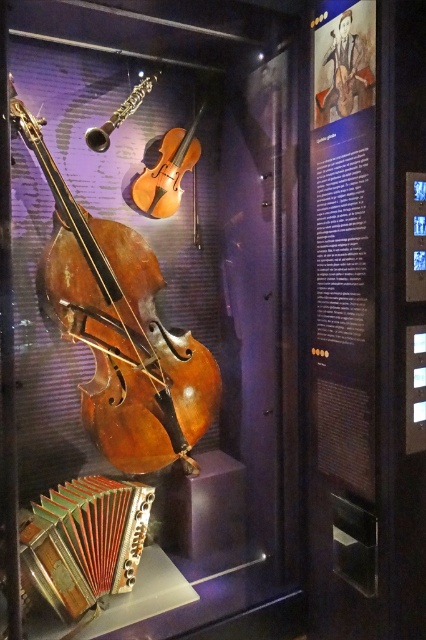
Is gold metallic accordion at lower left smaller than light brown wood violin at center?

Incorrect, gold metallic accordion at lower left is not smaller in size than light brown wood violin at center.

Identify the location of gold metallic accordion at lower left. The width and height of the screenshot is (426, 640). (85, 541).

The height and width of the screenshot is (640, 426). I want to click on gold metallic accordion at lower left, so click(85, 541).

Between wooden polished cello at center and gold metallic accordion at lower left, which one has less height?

With less height is gold metallic accordion at lower left.

Does wooden polished cello at center have a lesser height compared to gold metallic accordion at lower left?

In fact, wooden polished cello at center may be taller than gold metallic accordion at lower left.

Which is behind, point (178, 449) or point (115, 589)?

Positioned behind is point (178, 449).

This screenshot has height=640, width=426. I want to click on wooden polished cello at center, so click(x=120, y=330).

Can you confirm if wooden polished cello at center is shorter than light brown wood violin at center?

Incorrect, wooden polished cello at center's height does not fall short of light brown wood violin at center's.

Locate an element on the screen. wooden polished cello at center is located at coordinates (120, 330).